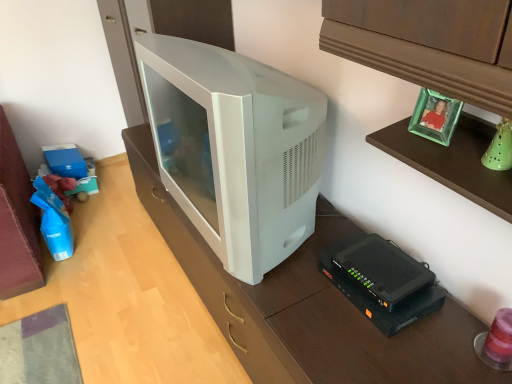
Question: Can you confirm if black plastic router at lower right is bigger than white plastic television at center?

Choices:
 (A) no
 (B) yes

Answer: (A)

Question: From a real-world perspective, is black plastic router at lower right located higher than white plastic television at center?

Choices:
 (A) no
 (B) yes

Answer: (A)

Question: Is black plastic router at lower right touching white plastic television at center?

Choices:
 (A) no
 (B) yes

Answer: (A)

Question: Is black plastic router at lower right smaller than white plastic television at center?

Choices:
 (A) no
 (B) yes

Answer: (B)

Question: Is black plastic router at lower right facing towards white plastic television at center?

Choices:
 (A) no
 (B) yes

Answer: (A)

Question: Can you confirm if black plastic router at lower right is shorter than white plastic television at center?

Choices:
 (A) yes
 (B) no

Answer: (A)

Question: Is white plastic television at center facing towards black plastic router at lower right?

Choices:
 (A) yes
 (B) no

Answer: (B)

Question: Is white plastic television at center to the right of black plastic router at lower right from the viewer's perspective?

Choices:
 (A) yes
 (B) no

Answer: (B)

Question: Considering the relative sizes of white plastic television at center and black plastic router at lower right in the image provided, is white plastic television at center wider than black plastic router at lower right?

Choices:
 (A) yes
 (B) no

Answer: (A)

Question: Does white plastic television at center have a greater height compared to black plastic router at lower right?

Choices:
 (A) no
 (B) yes

Answer: (B)

Question: Is white plastic television at center completely or partially outside of black plastic router at lower right?

Choices:
 (A) no
 (B) yes

Answer: (B)

Question: Can you see white plastic television at center touching black plastic router at lower right?

Choices:
 (A) yes
 (B) no

Answer: (B)

Question: Would you say white plastic television at center is to the left or to the right of black plastic router at lower right in the picture?

Choices:
 (A) right
 (B) left

Answer: (B)